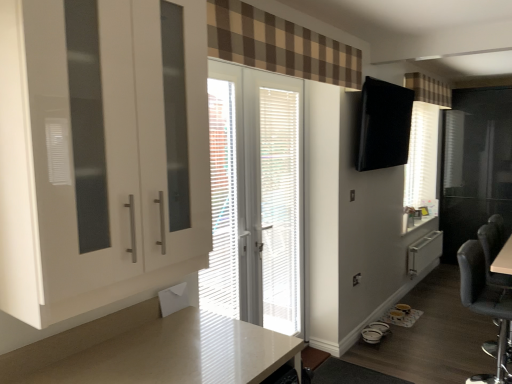
Question: Does white glossy door at center appear on the right side of brown checkered curtain at upper center, the 2th curtain when ordered from top to bottom?

Choices:
 (A) no
 (B) yes

Answer: (A)

Question: Does white glossy door at center have a smaller size compared to brown checkered curtain at upper center, which is counted as the first curtain, starting from the left?

Choices:
 (A) no
 (B) yes

Answer: (B)

Question: Considering the relative sizes of white glossy door at center and brown checkered curtain at upper center, which is the 2th curtain in back-to-front order, in the image provided, is white glossy door at center wider than brown checkered curtain at upper center, which is the 2th curtain in back-to-front order,?

Choices:
 (A) no
 (B) yes

Answer: (A)

Question: Is there a large distance between white glossy door at center and brown checkered curtain at upper center, placed as the 1th curtain when sorted from front to back?

Choices:
 (A) no
 (B) yes

Answer: (A)

Question: From a real-world perspective, is white glossy door at center on brown checkered curtain at upper center, acting as the 2th curtain starting from the right?

Choices:
 (A) no
 (B) yes

Answer: (A)

Question: Does white glossy door at center lie behind brown checkered curtain at upper center, arranged as the 1th curtain when ordered from the bottom?

Choices:
 (A) yes
 (B) no

Answer: (A)

Question: From the image's perspective, does white glossy countertop at lower center appear higher than brown checkered curtain at upper center, acting as the 2th curtain starting from the right?

Choices:
 (A) no
 (B) yes

Answer: (A)

Question: Is white glossy countertop at lower center oriented towards brown checkered curtain at upper center, acting as the 2th curtain starting from the right?

Choices:
 (A) no
 (B) yes

Answer: (A)

Question: From the image's perspective, is white glossy countertop at lower center located beneath brown checkered curtain at upper center, acting as the 2th curtain starting from the right?

Choices:
 (A) yes
 (B) no

Answer: (A)

Question: Considering the relative sizes of white glossy countertop at lower center and brown checkered curtain at upper center, arranged as the 1th curtain when ordered from the bottom, in the image provided, is white glossy countertop at lower center shorter than brown checkered curtain at upper center, arranged as the 1th curtain when ordered from the bottom,?

Choices:
 (A) no
 (B) yes

Answer: (A)

Question: Is brown checkered curtain at upper center, which is the 2th curtain in back-to-front order, located within white glossy countertop at lower center?

Choices:
 (A) yes
 (B) no

Answer: (B)

Question: Considering the relative positions of white glossy countertop at lower center and brown checkered curtain at upper center, which is the 2th curtain in back-to-front order, in the image provided, is white glossy countertop at lower center in front of brown checkered curtain at upper center, which is the 2th curtain in back-to-front order,?

Choices:
 (A) no
 (B) yes

Answer: (B)

Question: Considering the relative sizes of brown checkered curtain at upper center, which is counted as the first curtain, starting from the left, and white glossy cabinet at left in the image provided, is brown checkered curtain at upper center, which is counted as the first curtain, starting from the left, bigger than white glossy cabinet at left?

Choices:
 (A) no
 (B) yes

Answer: (A)